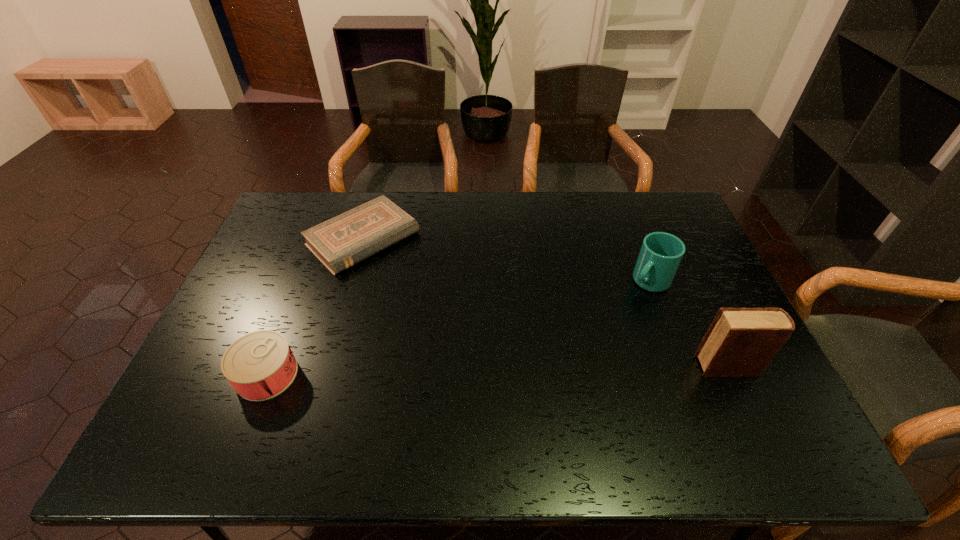
Locate an element on the screen. This screenshot has width=960, height=540. vacant space on the desktop that is between the second shortest object and the diary and is positioned on the spine side of the Bible is located at coordinates (509, 370).

Identify the location of free space on the desktop that is between the can and the tallest object and is positioned on the handle side of the third shortest object. coord(561,369).